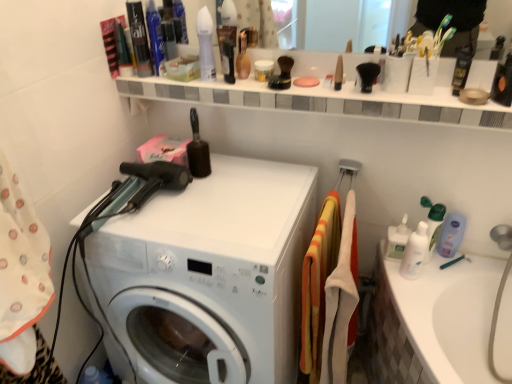
I want to click on blank space situated above white glossy shelf at upper center (from a real-world perspective), so click(x=325, y=89).